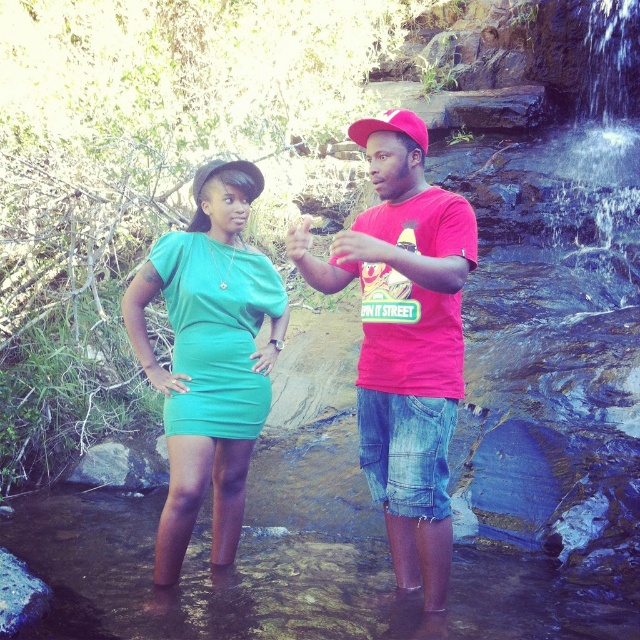
From the picture: Is the position of matte green dress at center more distant than that of pink fabric baseball cap at center?

Yes, matte green dress at center is further from the viewer.

Which of these two, matte green dress at center or pink fabric baseball cap at center, stands taller?

matte green dress at center

I want to click on matte green dress at center, so click(209, 356).

Where is `matte green dress at center`? This screenshot has width=640, height=640. matte green dress at center is located at coordinates (209, 356).

Is matte red t-shirt at center thinner than matte green dress at center?

Incorrect, matte red t-shirt at center's width is not less than matte green dress at center's.

Between matte red t-shirt at center and matte green dress at center, which one appears on the right side from the viewer's perspective?

matte red t-shirt at center

Describe the element at coordinates (404, 352) in the screenshot. I see `matte red t-shirt at center` at that location.

Locate an element on the screen. This screenshot has width=640, height=640. matte red t-shirt at center is located at coordinates (404, 352).

Which is in front, point (460, 362) or point (408, 113)?

Point (460, 362) is in front.

Is point (396, 145) behind point (387, 122)?

That is True.

Does point (397, 296) come in front of point (348, 132)?

Yes.

Find the location of a particular element. This screenshot has height=640, width=640. matte red t-shirt at center is located at coordinates (404, 352).